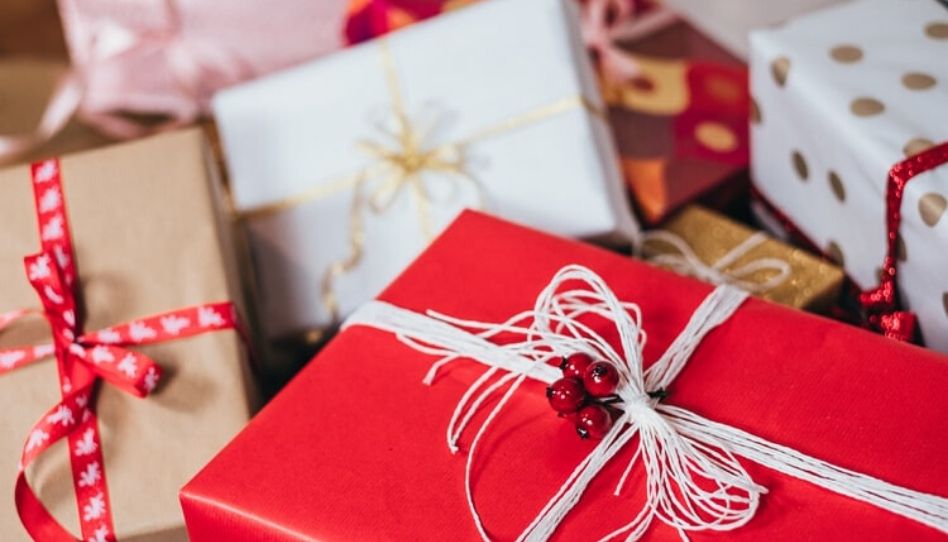
Image resolution: width=948 pixels, height=542 pixels. Identify the location of faux cranberries. (597, 383), (570, 400), (574, 369), (592, 425).